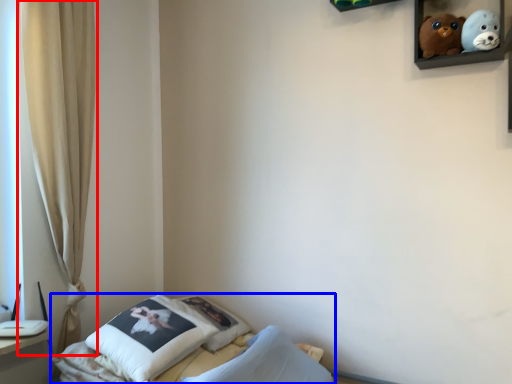
Question: Which of the following is the closest to the observer, curtain (highlighted by a red box) or bed (highlighted by a blue box)?

Choices:
 (A) curtain
 (B) bed

Answer: (B)